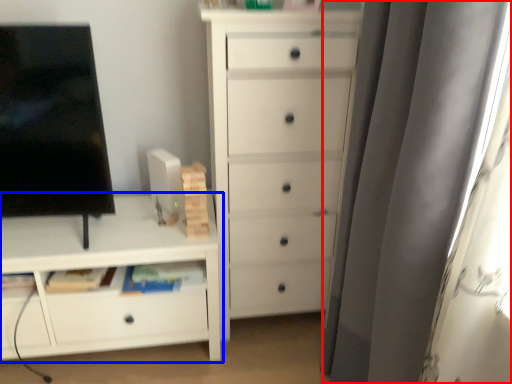
Question: Which object is closer to the camera taking this photo, curtain (highlighted by a red box) or chest of drawers (highlighted by a blue box)?

Choices:
 (A) curtain
 (B) chest of drawers

Answer: (A)